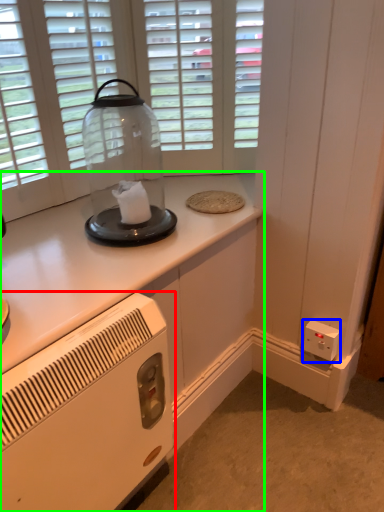
Question: Based on their relative distances, which object is farther from home appliance (highlighted by a red box)? Choose from electric outlet (highlighted by a blue box) and cabinetry (highlighted by a green box).

Choices:
 (A) electric outlet
 (B) cabinetry

Answer: (A)